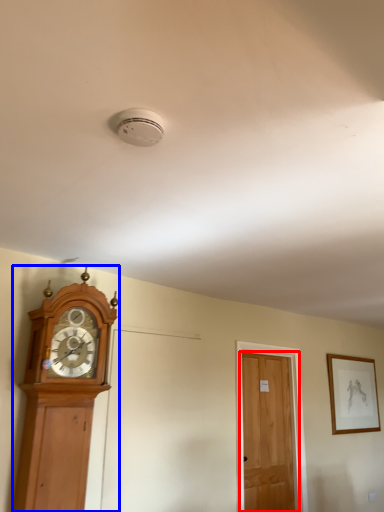
Question: Among these objects, which one is nearest to the camera, door (highlighted by a red box) or wall clock (highlighted by a blue box)?

Choices:
 (A) door
 (B) wall clock

Answer: (B)